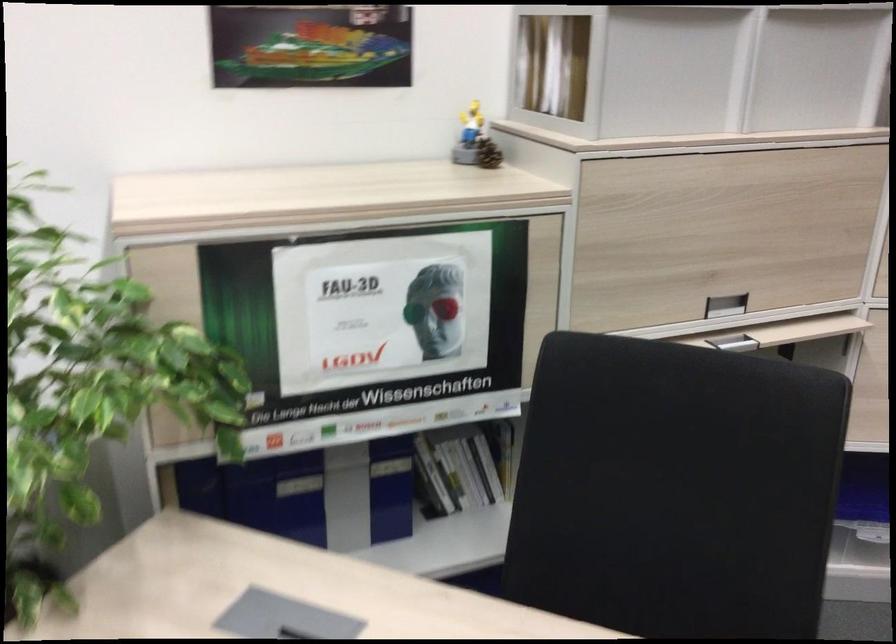
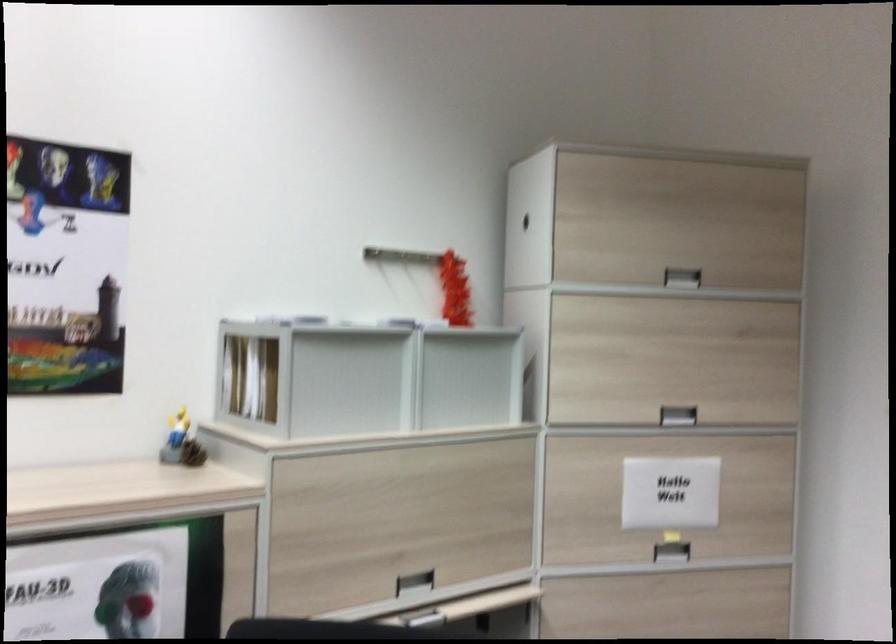
Locate, in the second image, the point that corresponds to [486,154] in the first image.

(192, 453)